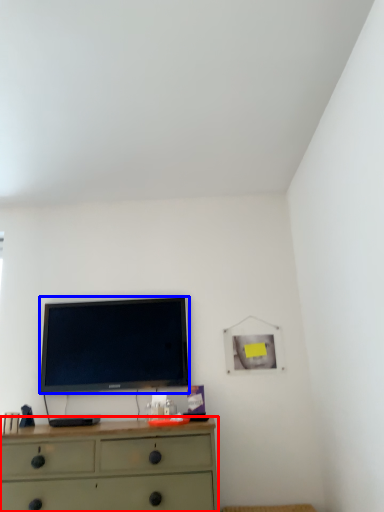
Question: Which point is closer to the camera, chest of drawers (highlighted by a red box) or television (highlighted by a blue box)?

Choices:
 (A) chest of drawers
 (B) television

Answer: (A)